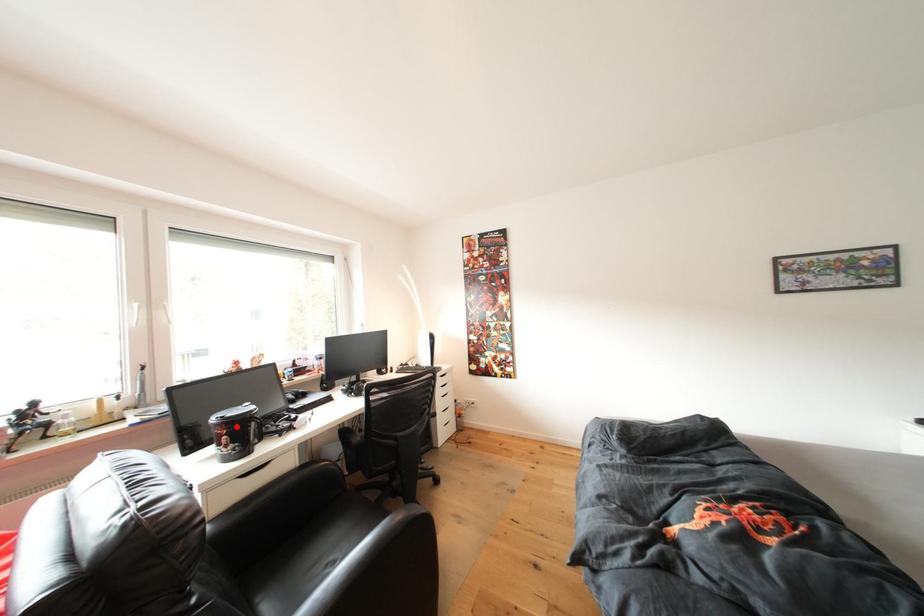
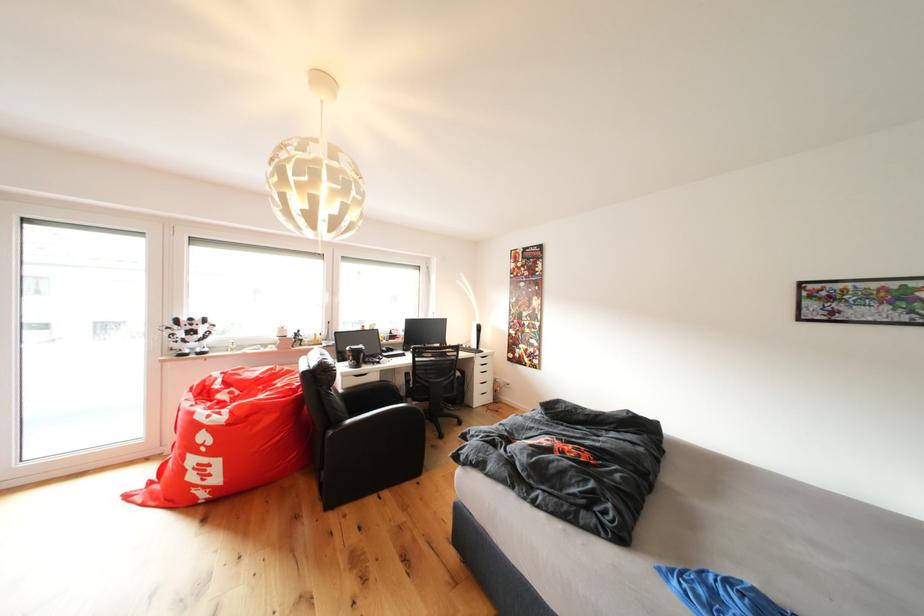
Locate, in the second image, the point that corresponds to the highlighted location in the first image.

(361, 355)